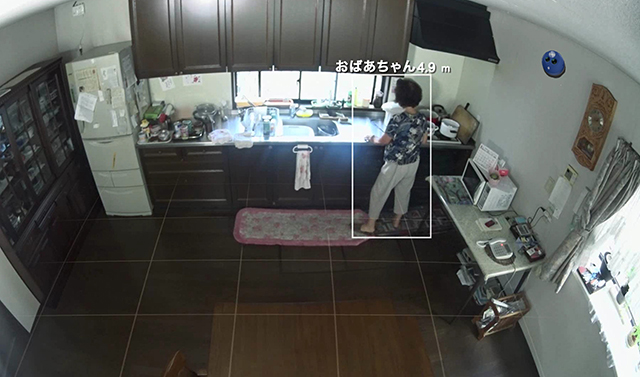
Locate an element on the screen. This screenshot has height=377, width=640. dish towel is located at coordinates (301, 180).